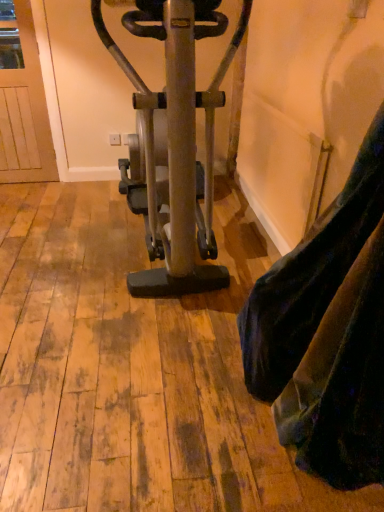
Locate an element on the screen. The height and width of the screenshot is (512, 384). vacant space situated on the left part of velvet-like fabric at lower right is located at coordinates (136, 401).